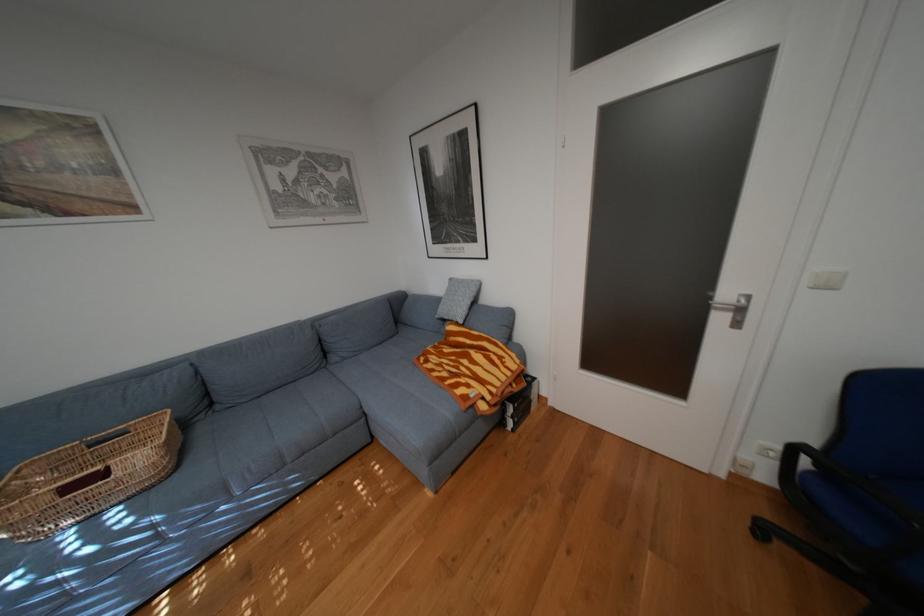
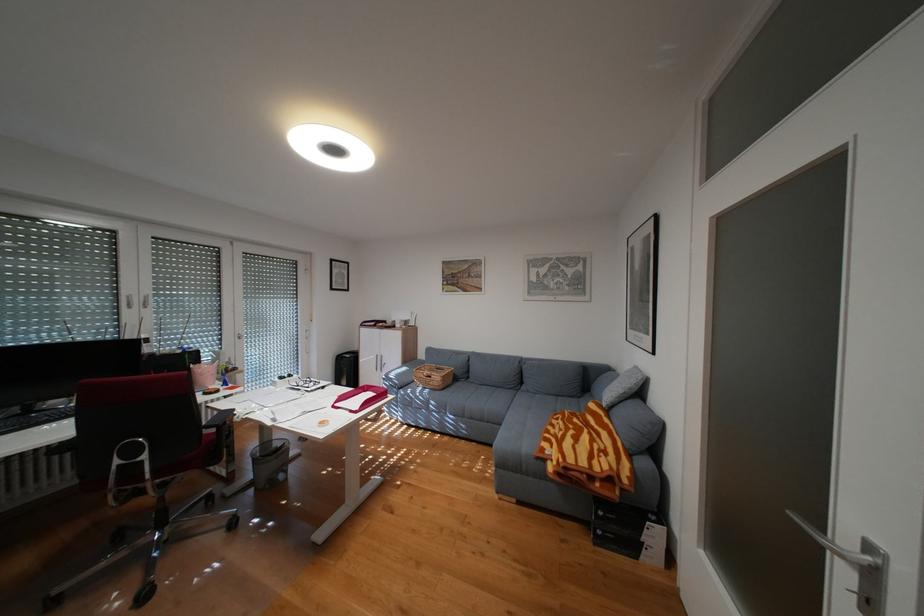
In the second image, find the point that corresponds to the point at 529,419 in the first image.

(612, 532)